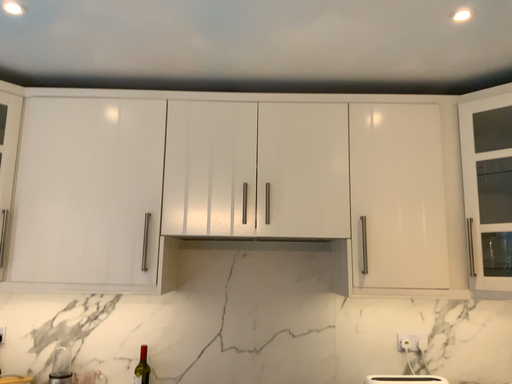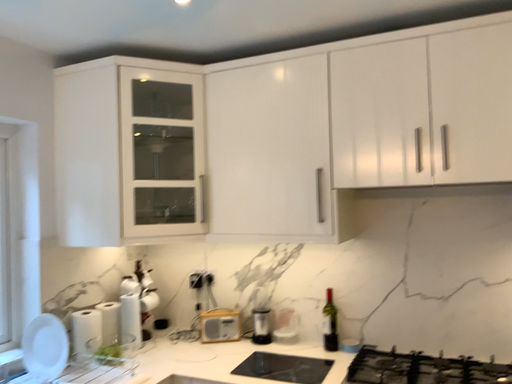
Question: How did the camera likely rotate when shooting the video?

Choices:
 (A) rotated right
 (B) rotated left

Answer: (B)